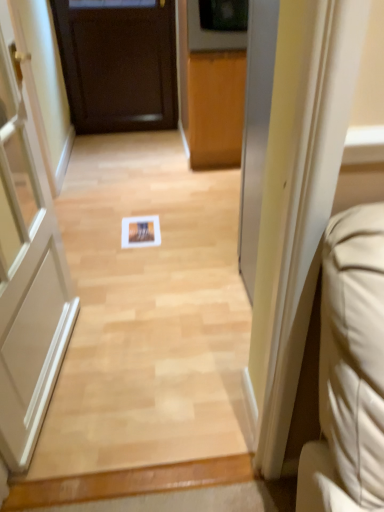
Locate an element on the screen. This screenshot has height=512, width=384. vacant area that is situated to the right of white matte door at left, which is counted as the first door, starting from the bottom is located at coordinates (154, 372).